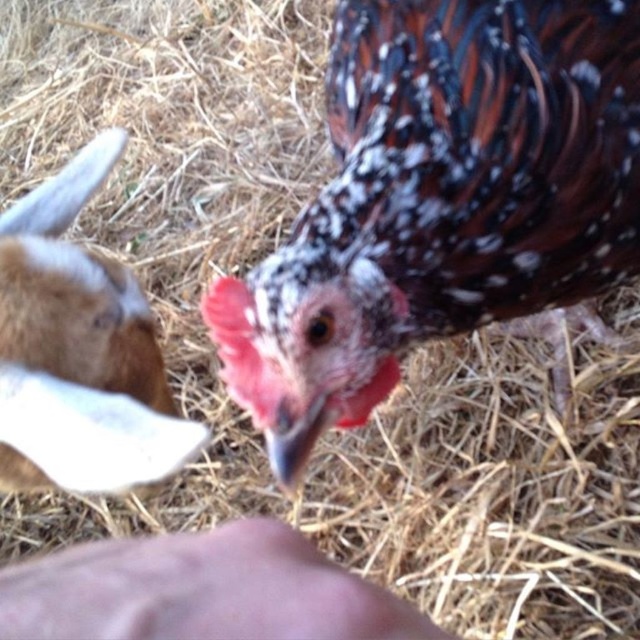
Looking at this image, you are a farmer checking on your animals. You see the speckled feathered chicken at center and the brown woolen goat at left. Which animal is closer to you?

The speckled feathered chicken at center is closer to you because it is positioned over the brown woolen goat at left, indicating it is in front.

You are standing in a farmyard and see the speckled feathered chicken at center and the brown woolen goat at left. Which animal is positioned further to the left?

The brown woolen goat at left is positioned further to the left than the speckled feathered chicken at center.

You are a farmer checking on your animals. You notice the speckled feathered chicken at center and the brown woolen goat at left. Which animal would you need to use a taller feeding trough for?

The speckled feathered chicken at center requires a taller feeding trough because it is larger in size compared to the brown woolen goat at left.